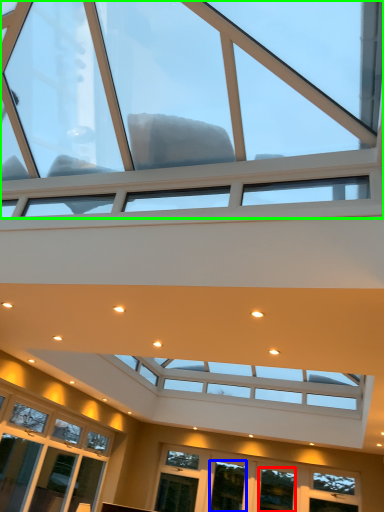
Question: Considering the real-world distances, which object is farthest from window (highlighted by a red box)? window (highlighted by a blue box) or window (highlighted by a green box)?

Choices:
 (A) window
 (B) window

Answer: (B)